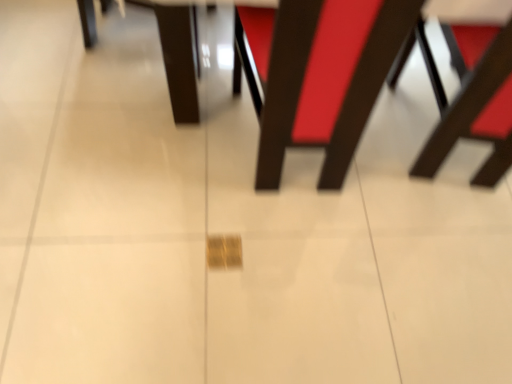
Question: Is matte brown chair at center, the 1th chair in the left-to-right sequence, situated inside wooden chair at right, marked as the second chair in a left-to-right arrangement, or outside?

Choices:
 (A) inside
 (B) outside

Answer: (B)

Question: In terms of height, does matte brown chair at center, the 1th chair in the left-to-right sequence, look taller or shorter compared to wooden chair at right, the 1th chair viewed from the right?

Choices:
 (A) short
 (B) tall

Answer: (B)

Question: In terms of width, does matte brown chair at center, the 2th chair viewed from the right, look wider or thinner when compared to wooden chair at right, marked as the second chair in a left-to-right arrangement?

Choices:
 (A) thin
 (B) wide

Answer: (B)

Question: Looking at the image, does wooden chair at right, marked as the second chair in a left-to-right arrangement, seem bigger or smaller compared to matte brown chair at center, the 2th chair viewed from the right?

Choices:
 (A) small
 (B) big

Answer: (A)

Question: From their relative heights in the image, would you say wooden chair at right, marked as the second chair in a left-to-right arrangement, is taller or shorter than matte brown chair at center, the 2th chair viewed from the right?

Choices:
 (A) tall
 (B) short

Answer: (B)

Question: From the image's perspective, is wooden chair at right, marked as the second chair in a left-to-right arrangement, above or below matte brown chair at center, the 1th chair in the left-to-right sequence?

Choices:
 (A) below
 (B) above

Answer: (B)

Question: In the image, is wooden chair at right, marked as the second chair in a left-to-right arrangement, positioned in front of or behind matte brown chair at center, the 2th chair viewed from the right?

Choices:
 (A) front
 (B) behind

Answer: (B)